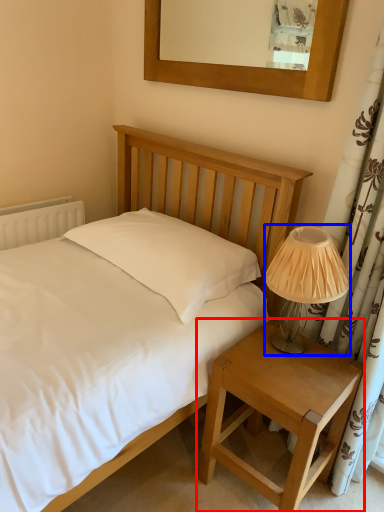
Question: Which object appears farthest to the camera in this image, nightstand (highlighted by a red box) or table lamp (highlighted by a blue box)?

Choices:
 (A) nightstand
 (B) table lamp

Answer: (B)